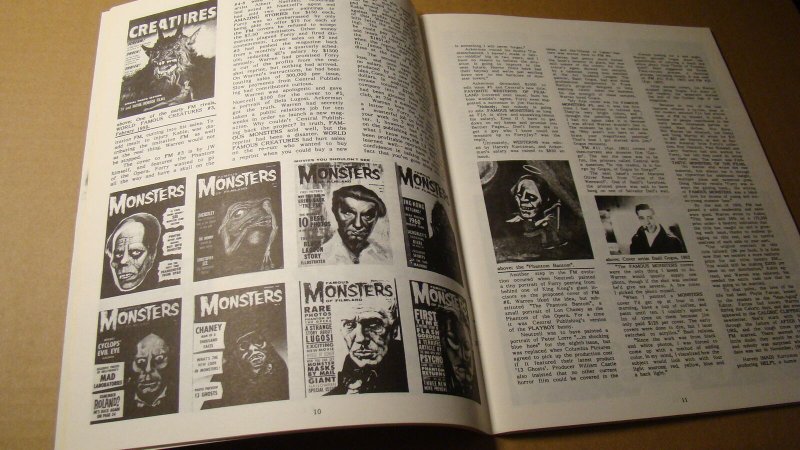
You are a GUI agent. You are given a task and a screenshot of the screen. Output one action in this format:
    pyautogui.click(x=<x>, y=<y>)
    Task: Click on the tabletop
    The image size is (800, 450).
    Given the screenshot: What is the action you would take?
    pyautogui.click(x=40, y=162), pyautogui.click(x=778, y=58), pyautogui.click(x=702, y=432)